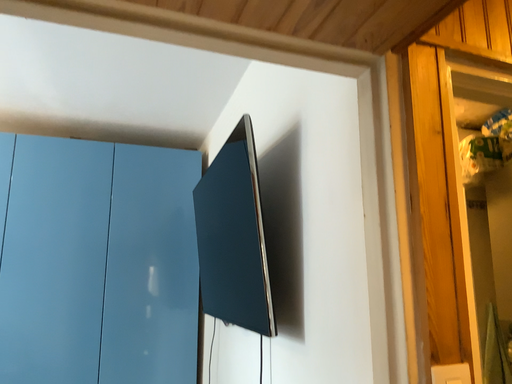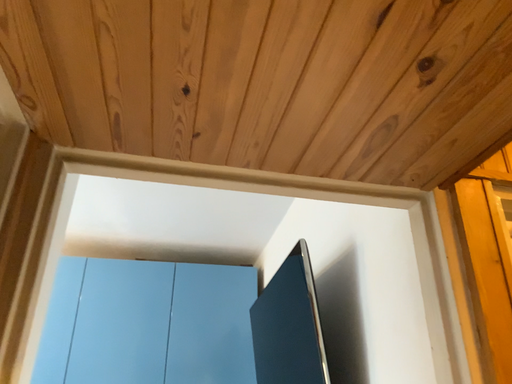
Question: How did the camera likely rotate when shooting the video?

Choices:
 (A) rotated left
 (B) rotated right

Answer: (A)